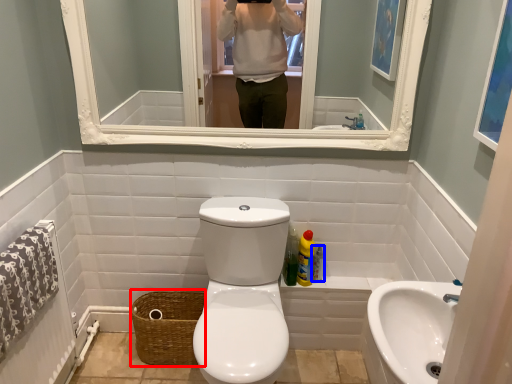
Question: Which object is further to the camera taking this photo, basket (highlighted by a red box) or toiletry (highlighted by a blue box)?

Choices:
 (A) basket
 (B) toiletry

Answer: (B)